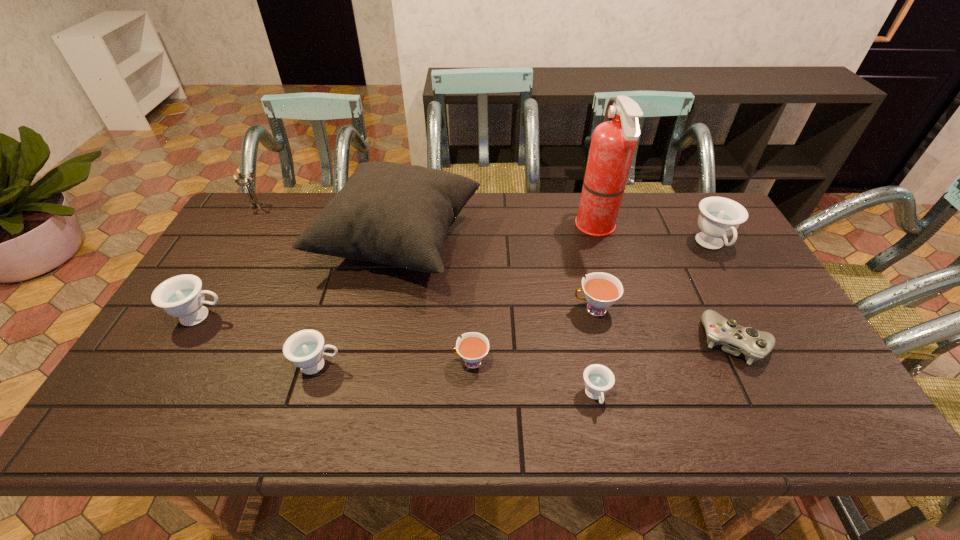
Find the location of a particular element. teacup that is the sixth nearest to the ninth shortest object is located at coordinates (719, 217).

This screenshot has height=540, width=960. What are the coordinates of `blue teacup that can be found as the closest to the right white teacup` in the screenshot? It's located at (598, 378).

You are a GUI agent. You are given a task and a screenshot of the screen. Output one action in this format:
    pyautogui.click(x=<x>, y=<y>)
    Task: Click on the blue teacup that is the second nearest to the left white teacup
    The image size is (960, 540).
    Given the screenshot: What is the action you would take?
    pyautogui.click(x=304, y=348)

The width and height of the screenshot is (960, 540). I want to click on free point that satisfies the following two spatial constraints: 1. on the side of the leftmost blue teacup with the handle; 2. on the back side of the control, so click(x=186, y=341).

Find the location of `free region that satisfies the following two spatial constraints: 1. on the side of the rightmost teacup with the handle; 2. on the side of the bigger white teacup with the handle`. free region that satisfies the following two spatial constraints: 1. on the side of the rightmost teacup with the handle; 2. on the side of the bigger white teacup with the handle is located at coordinates (747, 309).

At what (x,y) coordinates should I click in order to perform the action: click on free point that satisfies the following two spatial constraints: 1. on the side of the farthest teacup with the handle; 2. on the side of the right white teacup with the handle. Please return your answer as a coordinate pair (x, y). Looking at the image, I should click on (747, 309).

The width and height of the screenshot is (960, 540). In order to click on free space that satisfies the following two spatial constraints: 1. with the handle and hose on the fire extinguisher; 2. on the front side of the ninth shortest object in this screenshot , I will do `click(601, 243)`.

Locate an element on the screen. The image size is (960, 540). vacant area in the image that satisfies the following two spatial constraints: 1. on the side of the farthest teacup with the handle; 2. on the side of the nearer white teacup with the handle is located at coordinates pos(777,362).

This screenshot has height=540, width=960. In order to click on vacant point that satisfies the following two spatial constraints: 1. on the side of the biggest blue teacup with the handle; 2. on the side of the leftmost blue teacup with the handle in this screenshot , I will do `click(752, 316)`.